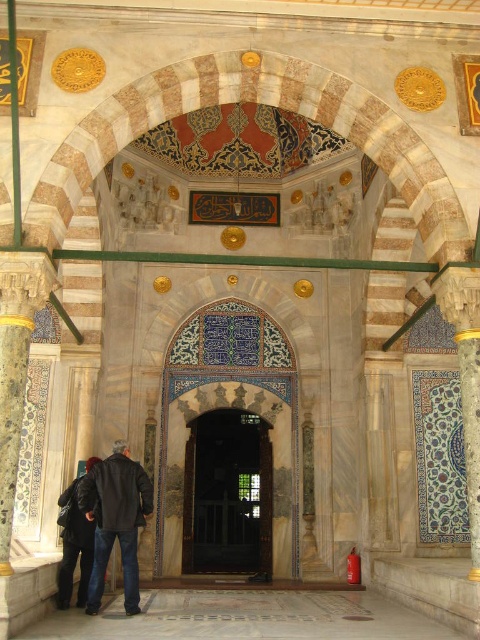
Question: Can you confirm if wooden door at center is smaller than blue glazed tile at center?

Choices:
 (A) yes
 (B) no

Answer: (A)

Question: Does wooden door at center appear under dark blue leather jacket at lower left?

Choices:
 (A) no
 (B) yes

Answer: (B)

Question: In this image, where is wooden door at center located relative to dark blue leather jacket at lower left?

Choices:
 (A) right
 (B) left

Answer: (A)

Question: Among these objects, which one is farthest from the camera?

Choices:
 (A) dark blue leather jacket at lower left
 (B) blue glazed tile at center

Answer: (A)

Question: Among these objects, which one is nearest to the camera?

Choices:
 (A) blue glazed tile at center
 (B) wooden door at center
 (C) dark blue leather jacket at lower left
 (D) dark gray leather jacket at center

Answer: (A)

Question: Which point appears farthest from the camera in this image?

Choices:
 (A) (60, 600)
 (B) (96, 580)
 (C) (222, 451)
 (D) (468, 417)

Answer: (C)